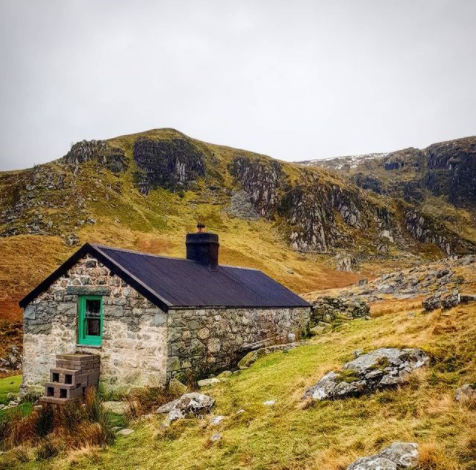
The width and height of the screenshot is (476, 470). Identify the location of door. (88, 309).